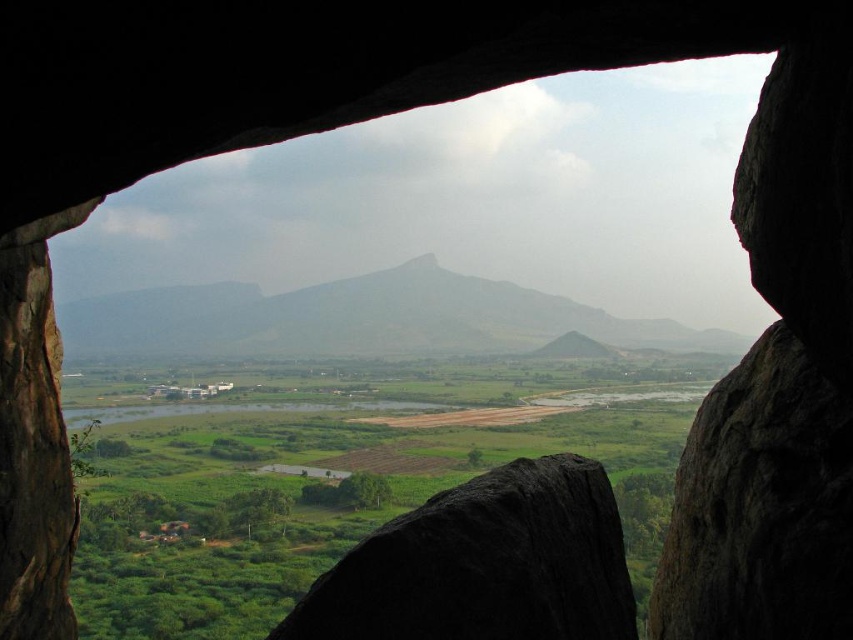
From the picture: You are standing inside the cave looking out through its arched opening. You notice two points marked in the scene. The first point is at coordinates point (730, 572) and the second is at point (387, 330). From your vantage point inside the cave, which point is closer to you?

Point (730, 572) is in front of point (387, 330), so from your position inside the cave, point (730, 572) is closer to you.

You are standing inside the cave looking out through the opening. You notice two rocks outside the cave entrance. The dark gray rough rock at right and the black rough rock at center. Which rock is taller?

The dark gray rough rock at right is much taller than the black rough rock at center.

You are an explorer standing inside the cave and looking out through its opening. You notice two rocks outside the cave entrance. The dark gray rough rock at right and the gray rock formation at center. Which of these rocks is narrower in width?

The dark gray rough rock at right is thinner than the gray rock formation at center, so the dark gray rough rock at right is narrower in width.